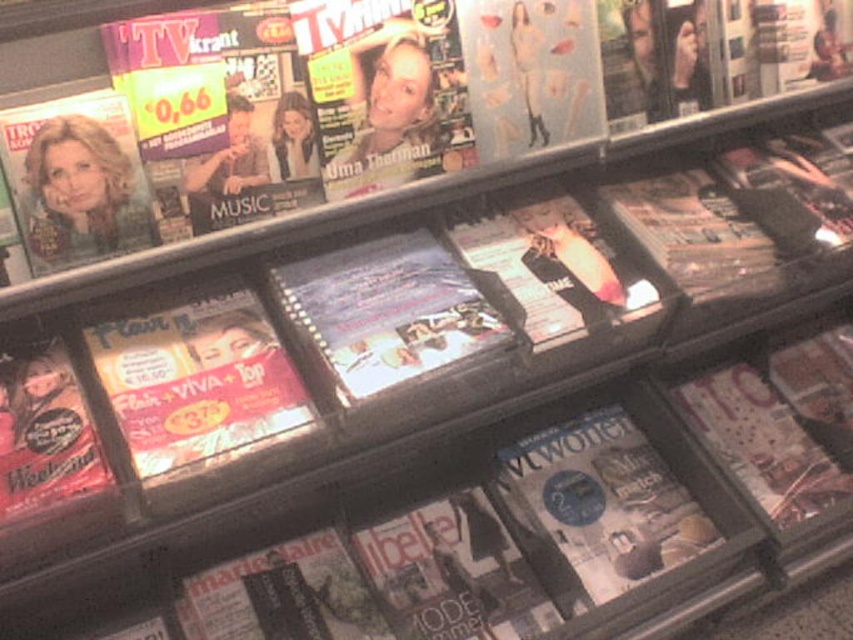
Question: Considering the real-world distances, which object is closest to the matte blue magazine at center?

Choices:
 (A) matte glossy magazine at center
 (B) matte plastic magazine at center left

Answer: (B)

Question: From the image, what is the correct spatial relationship of matte plastic magazine at center left in relation to blue glossy magazine at center?

Choices:
 (A) above
 (B) below

Answer: (A)

Question: Among these objects, which one is nearest to the camera?

Choices:
 (A) matte plastic magazine at center left
 (B) matte glossy magazine at center
 (C) blue glossy magazine at center
 (D) matte blue magazine at center

Answer: (A)

Question: Which is nearer to the blue glossy magazine at center?

Choices:
 (A) matte plastic magazine at center left
 (B) matte blue magazine at center
 (C) matte glossy magazine at center

Answer: (B)

Question: From the image, what is the correct spatial relationship of matte plastic magazine at center left in relation to matte blue magazine at center?

Choices:
 (A) left
 (B) right

Answer: (A)

Question: Can you confirm if blue glossy magazine at center is bigger than matte blue magazine at center?

Choices:
 (A) yes
 (B) no

Answer: (A)